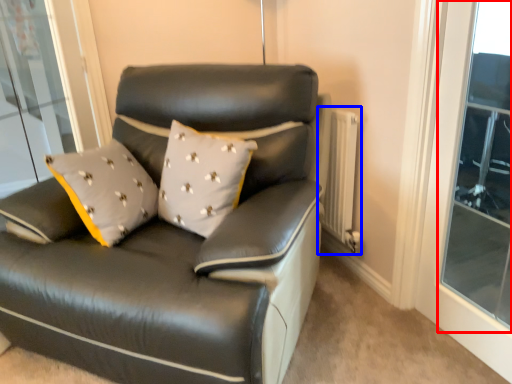
Question: Which object appears closest to the camera in this image, window (highlighted by a red box) or radiator (highlighted by a blue box)?

Choices:
 (A) window
 (B) radiator

Answer: (A)